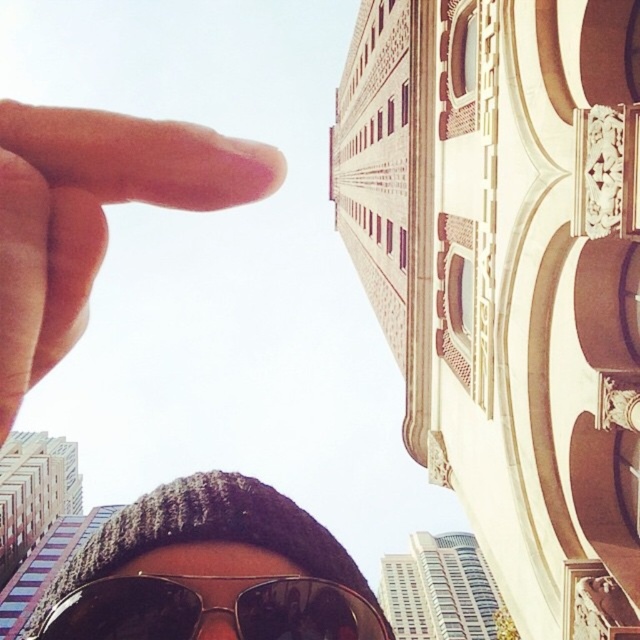
Can you confirm if knitted wool hat at center is smaller than pale skin finger at upper left?

No, knitted wool hat at center is not smaller than pale skin finger at upper left.

Which is above, knitted wool hat at center or pale skin finger at upper left?

pale skin finger at upper left is above.

This screenshot has width=640, height=640. Describe the element at coordinates (211, 572) in the screenshot. I see `knitted wool hat at center` at that location.

The image size is (640, 640). In order to click on knitted wool hat at center in this screenshot , I will do `click(211, 572)`.

Can you confirm if knitted wool hat at center is wider than sunglasses at center?

Correct, the width of knitted wool hat at center exceeds that of sunglasses at center.

Which is more to the right, knitted wool hat at center or sunglasses at center?

sunglasses at center

This screenshot has height=640, width=640. What do you see at coordinates (211, 572) in the screenshot?
I see `knitted wool hat at center` at bounding box center [211, 572].

Where is `knitted wool hat at center`? The height and width of the screenshot is (640, 640). knitted wool hat at center is located at coordinates (211, 572).

From the picture: Is pale skin finger at upper left bigger than sunglasses at center?

Indeed, pale skin finger at upper left has a larger size compared to sunglasses at center.

Does point (1, 113) lie behind point (344, 636)?

No, (1, 113) is in front of (344, 636).

The width and height of the screenshot is (640, 640). In order to click on pale skin finger at upper left in this screenshot , I will do `click(92, 214)`.

Identify the location of pale skin finger at upper left. (92, 214).